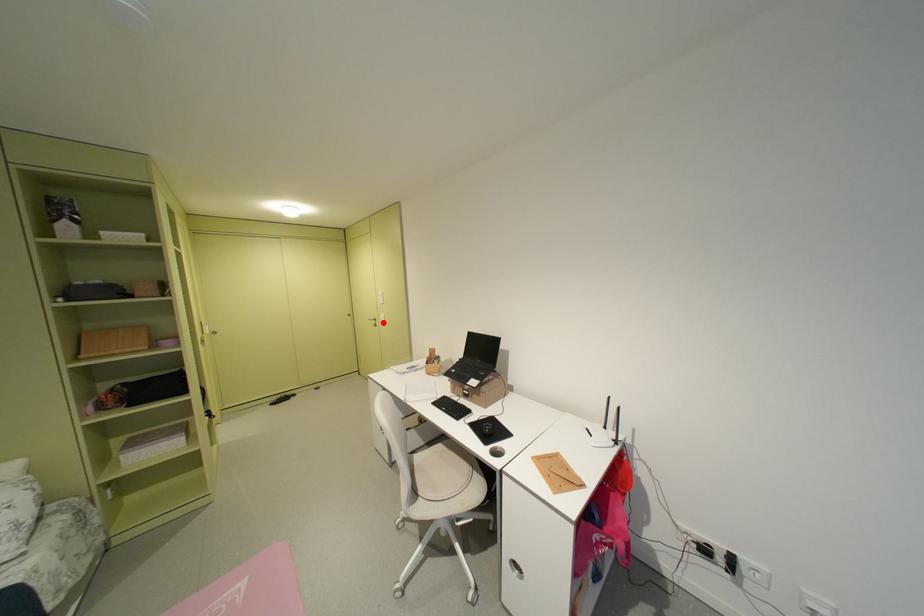
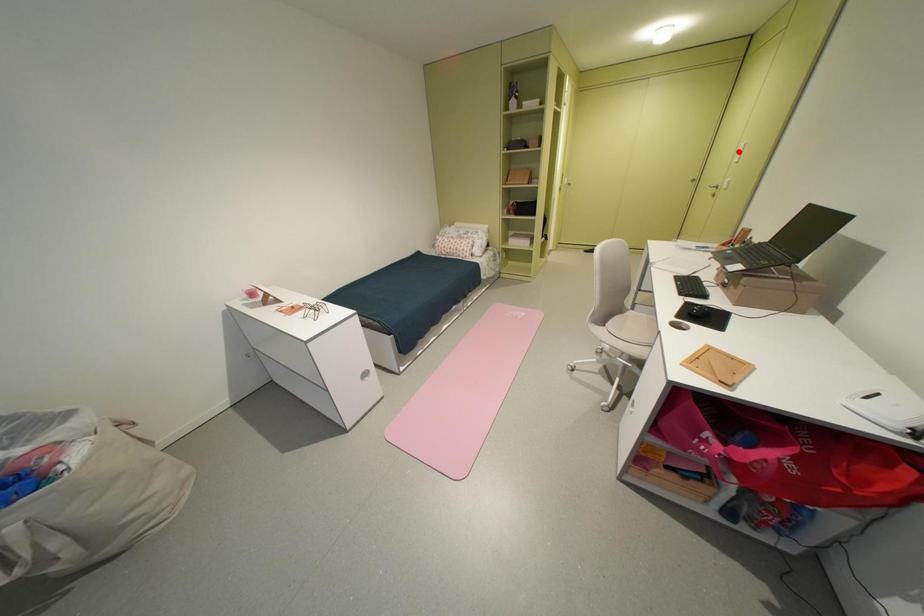
I am providing you with two images of the same scene from different viewpoints. A red point is marked on the first image and another point is marked on the second image. Are the points marked in image1 and image2 representing the same 3D position?

No